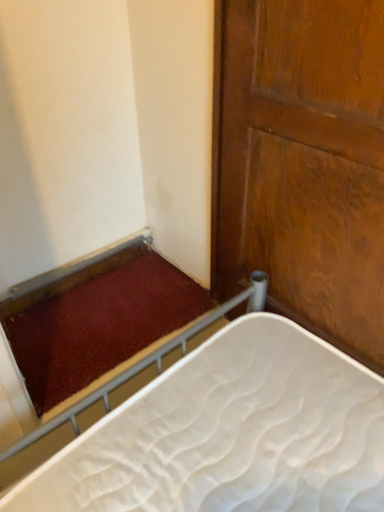
Question: Should I look upward or downward to see wooden door at right?

Choices:
 (A) down
 (B) up

Answer: (B)